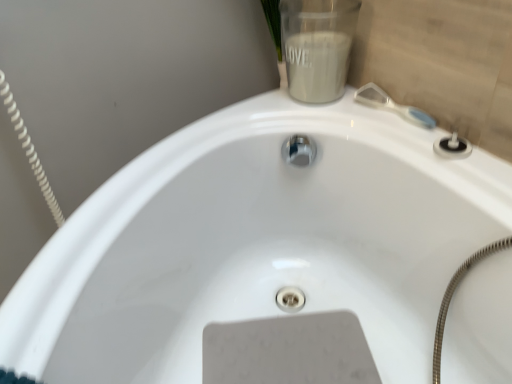
Question: From a real-world perspective, does clear plastic brush at upper right stand above matte white jar at upper right?

Choices:
 (A) no
 (B) yes

Answer: (A)

Question: From the image's perspective, is clear plastic brush at upper right beneath matte white jar at upper right?

Choices:
 (A) yes
 (B) no

Answer: (A)

Question: Is clear plastic brush at upper right turned away from matte white jar at upper right?

Choices:
 (A) yes
 (B) no

Answer: (B)

Question: Considering the relative sizes of clear plastic brush at upper right and matte white jar at upper right in the image provided, is clear plastic brush at upper right taller than matte white jar at upper right?

Choices:
 (A) yes
 (B) no

Answer: (B)

Question: Is clear plastic brush at upper right beside matte white jar at upper right?

Choices:
 (A) no
 (B) yes

Answer: (A)

Question: Considering the relative positions of clear plastic brush at upper right and matte white jar at upper right in the image provided, is clear plastic brush at upper right to the left of matte white jar at upper right from the viewer's perspective?

Choices:
 (A) yes
 (B) no

Answer: (B)

Question: Can you confirm if matte white jar at upper right is taller than clear plastic brush at upper right?

Choices:
 (A) no
 (B) yes

Answer: (B)

Question: Is matte white jar at upper right not near clear plastic brush at upper right?

Choices:
 (A) yes
 (B) no

Answer: (B)

Question: Is matte white jar at upper right looking in the opposite direction of clear plastic brush at upper right?

Choices:
 (A) no
 (B) yes

Answer: (A)

Question: Can you confirm if matte white jar at upper right is thinner than clear plastic brush at upper right?

Choices:
 (A) no
 (B) yes

Answer: (A)

Question: From the image's perspective, is matte white jar at upper right under clear plastic brush at upper right?

Choices:
 (A) yes
 (B) no

Answer: (B)

Question: Does matte white jar at upper right contain clear plastic brush at upper right?

Choices:
 (A) yes
 (B) no

Answer: (B)

Question: Is clear plastic brush at upper right in front of or behind matte white jar at upper right in the image?

Choices:
 (A) behind
 (B) front

Answer: (B)